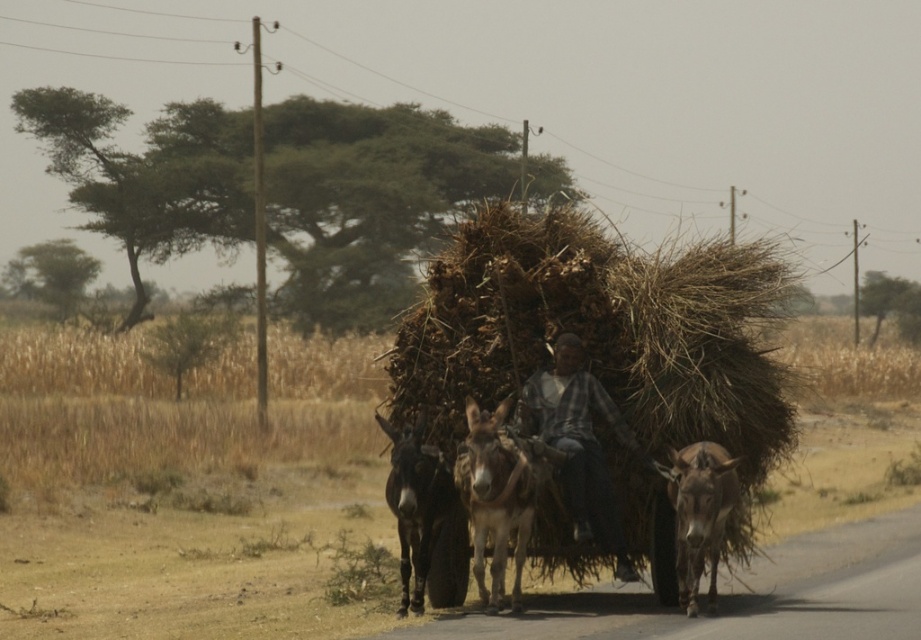
You are a traveler who needs to cross a narrow bridge. The bridge can only hold the weight of either the plaid fabric shirt at center or the brown rough donkey at center. Which one should you prioritize to cross first to ensure safety?

The brown rough donkey at center is behind the plaid fabric shirt at center, so the plaid fabric shirt at center is closer to the front. To ensure safety, prioritize moving the plaid fabric shirt at center first as it is in front and can be accessed more easily.

Based on the scene description, if you were to look at the image, which object would you see positioned higher up between the plaid fabric shirt at center and the brown rough donkey at center?

The plaid fabric shirt at center is positioned above the brown rough donkey at center, so it is higher up.

You are standing at the point marked by the coordinate point at (496, 497). What object is directly in front of you?

The point at (496, 497) marks the brown rough donkey at center, so the object directly in front of you is the brown rough donkey at center.